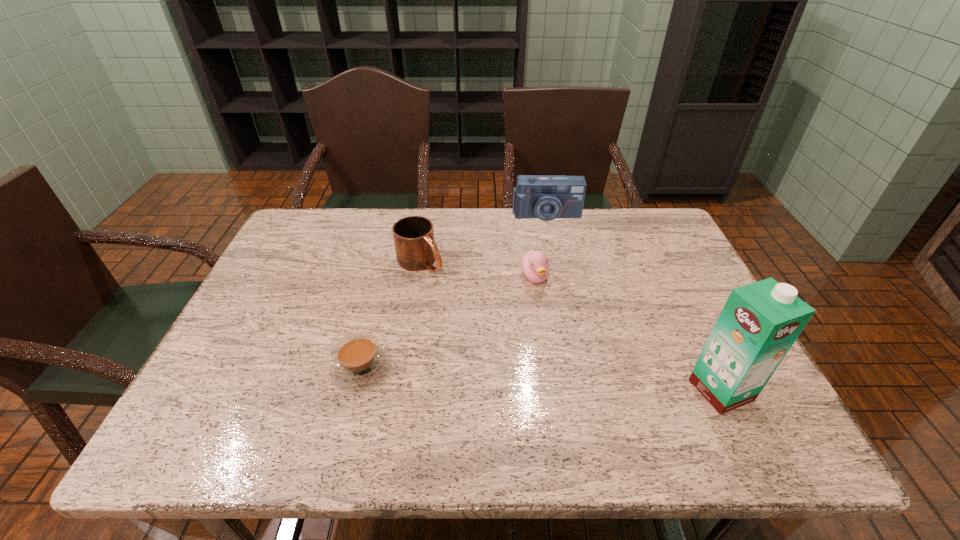
Where is `free space on the desktop that is between the cappuccino and the rightmost object and is positioned on the front-facing side of the duckling`? free space on the desktop that is between the cappuccino and the rightmost object and is positioned on the front-facing side of the duckling is located at coordinates (589, 382).

Locate an element on the screen. vacant space on the desktop that is between the cappuccino and the rightmost object and is positioned on the side of the mug with the handle is located at coordinates (574, 381).

I want to click on free space on the desktop that is between the cappuccino and the carton and is positioned on the lens of the camera, so click(x=572, y=381).